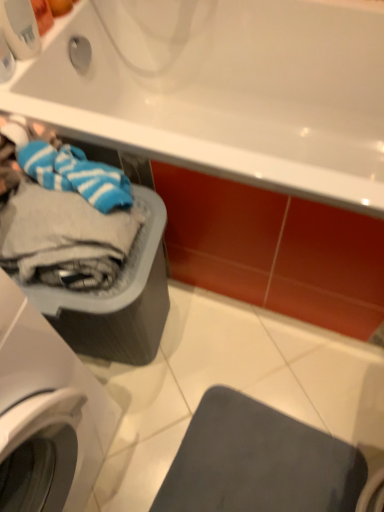
Question: From a real-world perspective, relative to white plastic washing machine at left, is matte gray mat at lower right vertically above or below?

Choices:
 (A) above
 (B) below

Answer: (B)

Question: From the image's perspective, is matte gray mat at lower right above or below white plastic washing machine at left?

Choices:
 (A) below
 (B) above

Answer: (A)

Question: Estimate the real-world distances between objects in this image. Which object is farther from the white plastic washing machine at left?

Choices:
 (A) matte gray plastic basket at lower left
 (B) matte gray mat at lower right
 (C) white glossy bathtub at upper center

Answer: (C)

Question: Estimate the real-world distances between objects in this image. Which object is closer to the white glossy bathtub at upper center?

Choices:
 (A) matte gray mat at lower right
 (B) matte gray plastic basket at lower left
 (C) white plastic washing machine at left

Answer: (B)